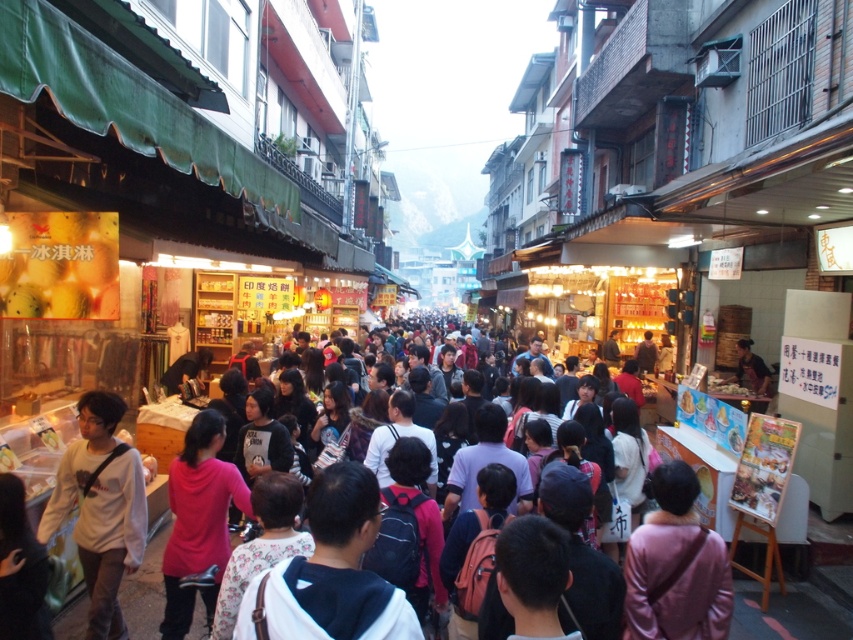
Question: Estimate the real-world distances between objects in this image. Which object is farther from the white matte sweatshirt at center?

Choices:
 (A) pink fabric bag at center
 (B) dark brown leather jacket at center

Answer: (B)

Question: Is white matte sweatshirt at center positioned before pink fabric bag at center?

Choices:
 (A) yes
 (B) no

Answer: (B)

Question: Which object is positioned farthest from the pink fabric bag at center?

Choices:
 (A) white matte sweatshirt at center
 (B) dark brown leather jacket at center

Answer: (B)

Question: Based on their relative distances, which object is farther from the white matte sweatshirt at center?

Choices:
 (A) dark brown leather jacket at center
 (B) pink fabric bag at center

Answer: (A)

Question: Does white matte sweatshirt at center appear under dark brown leather jacket at center?

Choices:
 (A) no
 (B) yes

Answer: (B)

Question: Can you confirm if white matte sweatshirt at center is smaller than pink fabric bag at center?

Choices:
 (A) no
 (B) yes

Answer: (A)